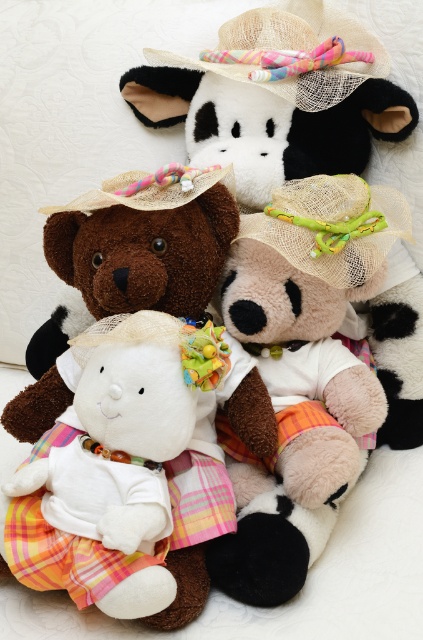
You are standing 30 inches away from the image. Can you reach the white plush teddy bear at center without moving your position?

The white plush teddy bear at center is 27.73 inches away from the camera. Since you are standing 30 inches away from the image, you can reach it by extending your arm if the distance between you and the camera is accounted for, but the exact reach depends on your arm length.